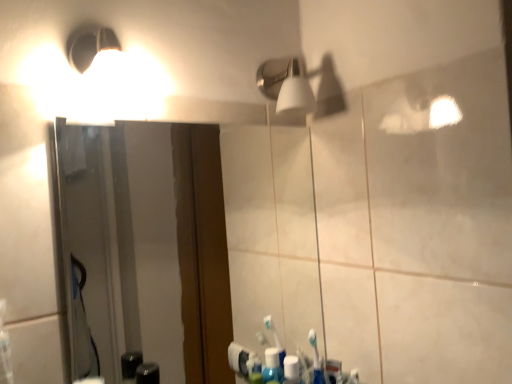
Question: In the image, is white matte light fixture at upper center on the left side or the right side of clear glass mirror at center?

Choices:
 (A) left
 (B) right

Answer: (B)

Question: Considering the positions of white matte light fixture at upper center and clear glass mirror at center in the image, is white matte light fixture at upper center wider or thinner than clear glass mirror at center?

Choices:
 (A) thin
 (B) wide

Answer: (B)

Question: Considering the positions of white matte light fixture at upper center and clear glass mirror at center in the image, is white matte light fixture at upper center taller or shorter than clear glass mirror at center?

Choices:
 (A) tall
 (B) short

Answer: (B)

Question: Is clear glass mirror at center wider or thinner than white matte light fixture at upper center?

Choices:
 (A) wide
 (B) thin

Answer: (B)

Question: In terms of height, does clear glass mirror at center look taller or shorter compared to white matte light fixture at upper center?

Choices:
 (A) tall
 (B) short

Answer: (A)

Question: Is clear glass mirror at center bigger or smaller than white matte light fixture at upper center?

Choices:
 (A) big
 (B) small

Answer: (A)

Question: Is clear glass mirror at center to the left or to the right of white matte light fixture at upper center in the image?

Choices:
 (A) right
 (B) left

Answer: (B)